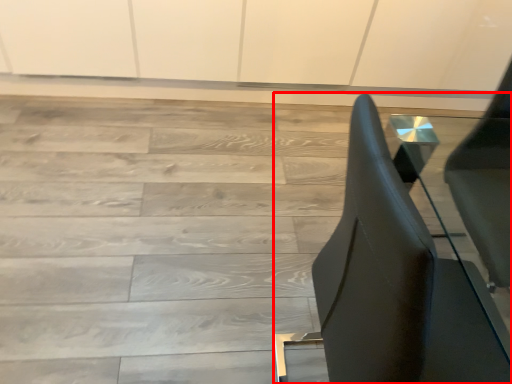
Question: From the image's perspective, where is furniture (annotated by the red box) located in relation to stairwell in the image?

Choices:
 (A) above
 (B) below

Answer: (B)